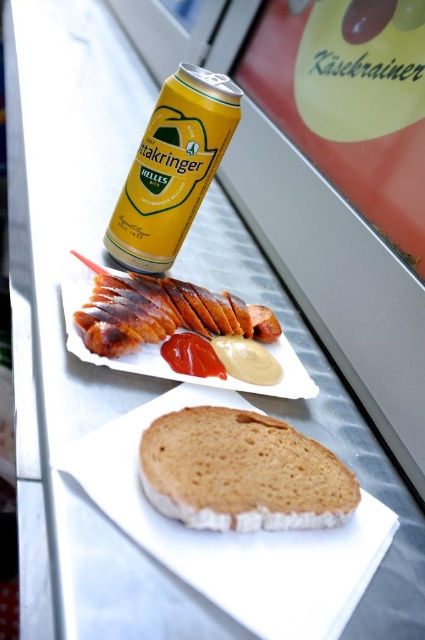
You are at a picnic and want to grab the smokey brown sausage at center. However, you notice the yellow matte can at upper center is blocking your path. Can you move the can to the right to access the sausage?

The yellow matte can at upper center is positioned on the left side of smokey brown sausage at center, so moving it to the right would clear the path to the sausage.

What object is located at the coordinates point (172, 168) in the image?

The yellow matte can at upper center is located at point (172, 168).

You are a bartender who needs to place a coaster under the yellow matte can at upper center and the smokey brown sausage at center. Which object requires a larger coaster to fit underneath?

The yellow matte can at upper center requires a larger coaster because it is larger in size than the smokey brown sausage at center.